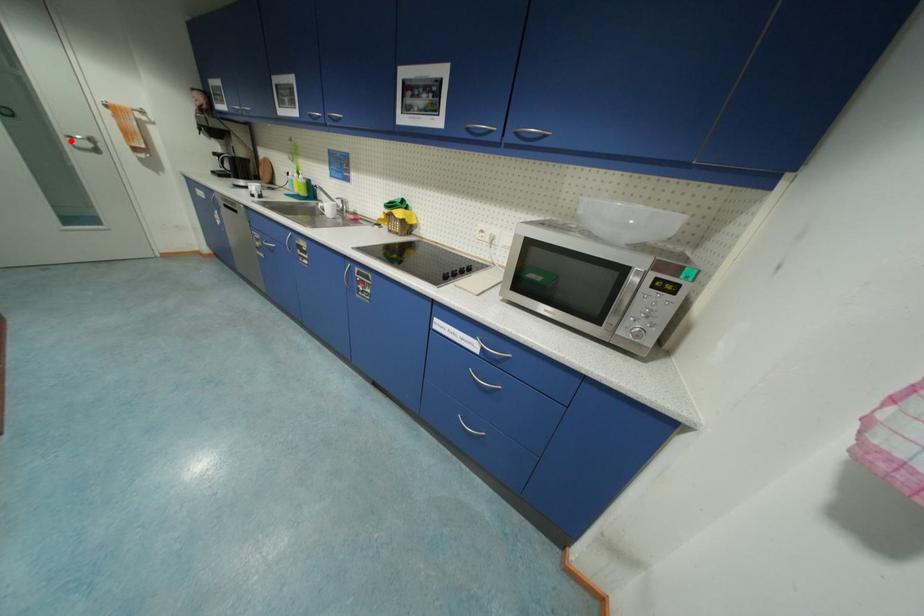
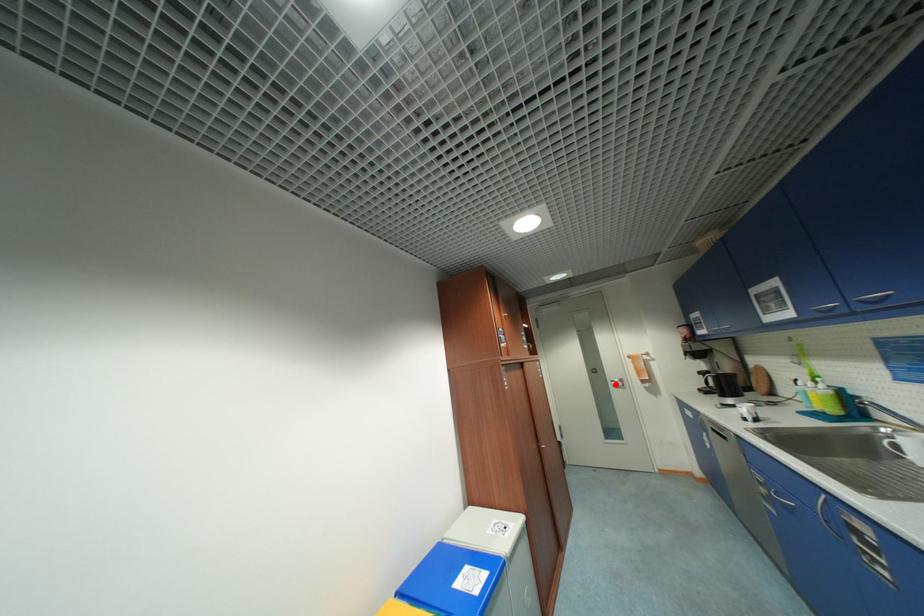
I am providing you with two images of the same scene from different viewpoints. A red point is marked on the first image and another point is marked on the second image. Is the marked point in image1 the same physical position as the marked point in image2?

Yes